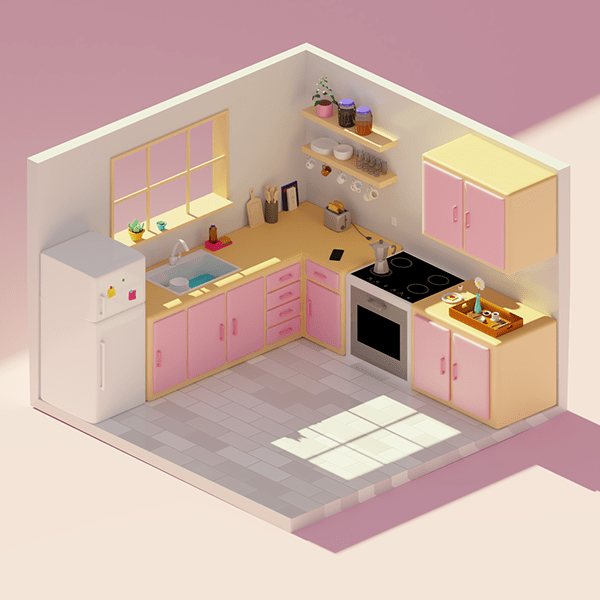
Where is `yellow square on freezer door`? This screenshot has width=600, height=600. yellow square on freezer door is located at coordinates (112, 292).